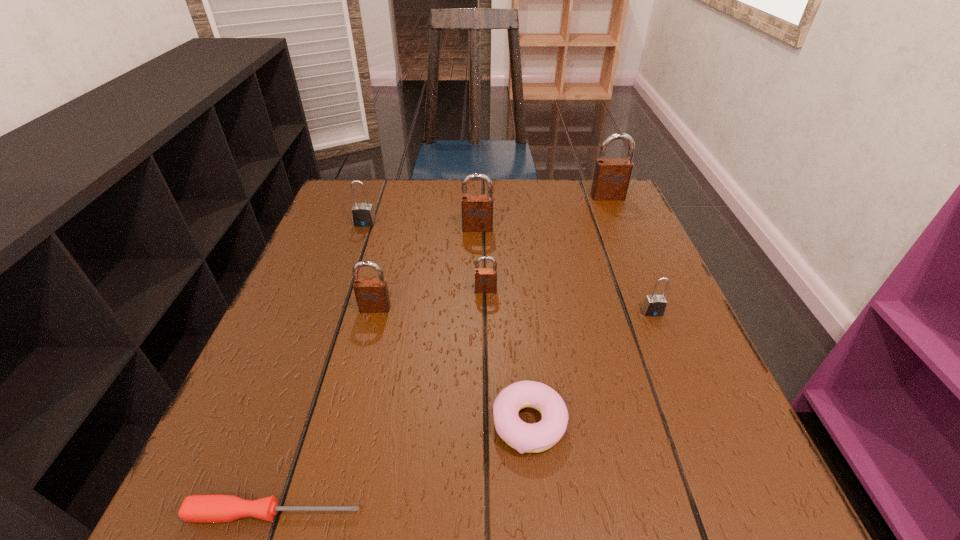
Identify the location of free spot located on the shackle of the right gray padlock. (708, 448).

Identify the location of free spot located 0.050m on the front-facing side of the smallest brown padlock. point(486,310).

The image size is (960, 540). I want to click on vacant space located on the front of the seventh farthest object, so click(538, 517).

Locate an element on the screen. The image size is (960, 540). free space located at the tip of the nearest object is located at coordinates (473, 513).

The image size is (960, 540). What are the coordinates of `doughnut situated at the near edge` in the screenshot? It's located at (524, 437).

The width and height of the screenshot is (960, 540). I want to click on screwdriver located in the near edge section of the desktop, so click(218, 508).

In order to click on screwdriver positioned at the left edge in this screenshot , I will do `click(218, 508)`.

Find the location of a particular element. This screenshot has width=960, height=540. object located in the far left corner section of the desktop is located at coordinates (363, 215).

At what (x,y) coordinates should I click in order to perform the action: click on object located at the near left corner. Please return your answer as a coordinate pair (x, y). This screenshot has width=960, height=540. Looking at the image, I should click on (218, 508).

Identify the location of object located in the far right corner section of the desktop. (611, 178).